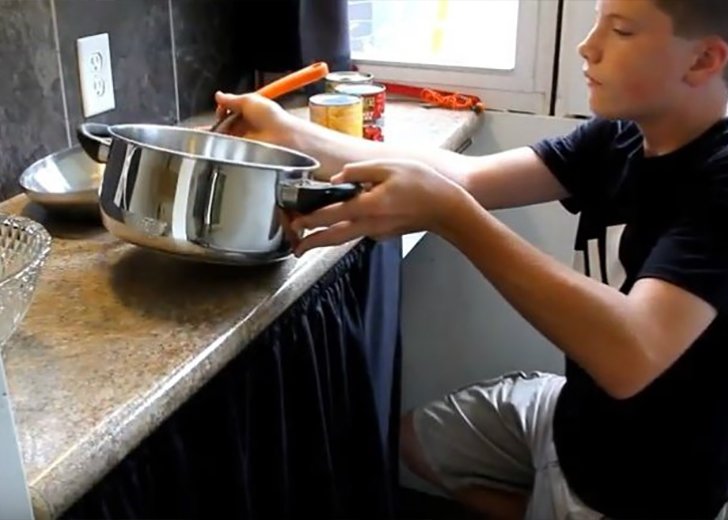
At what (x,y) coordinates should I click in order to perform the action: click on large glass textured bowl. Please return your answer as a coordinate pair (x, y). The height and width of the screenshot is (520, 728). Looking at the image, I should click on (9, 252).